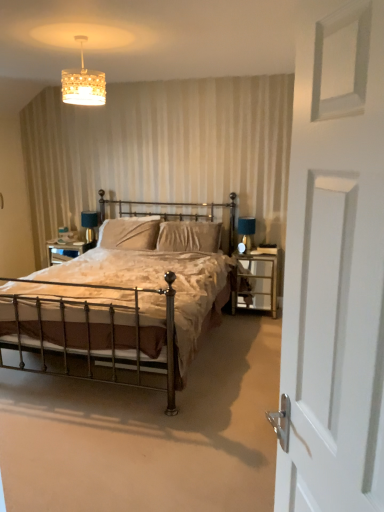
Question: Is matte blue glass table lamp at right located within white matte door at right?

Choices:
 (A) yes
 (B) no

Answer: (B)

Question: Can you confirm if white matte door at right is wider than matte blue glass table lamp at right?

Choices:
 (A) no
 (B) yes

Answer: (A)

Question: Is white matte door at right outside of matte blue glass table lamp at right?

Choices:
 (A) no
 (B) yes

Answer: (B)

Question: From the image's perspective, is white matte door at right below matte blue glass table lamp at right?

Choices:
 (A) no
 (B) yes

Answer: (B)

Question: Is white matte door at right positioned with its back to matte blue glass table lamp at right?

Choices:
 (A) no
 (B) yes

Answer: (A)

Question: Would you say white matte door at right is a long distance from matte blue glass table lamp at right?

Choices:
 (A) yes
 (B) no

Answer: (A)

Question: Does bronze metal bed at center have a greater width compared to metal/glass nightstand at right?

Choices:
 (A) no
 (B) yes

Answer: (B)

Question: Can you confirm if bronze metal bed at center is shorter than metal/glass nightstand at right?

Choices:
 (A) no
 (B) yes

Answer: (A)

Question: Could metal/glass nightstand at right be considered to be inside bronze metal bed at center?

Choices:
 (A) yes
 (B) no

Answer: (B)

Question: Does bronze metal bed at center appear on the right side of metal/glass nightstand at right?

Choices:
 (A) no
 (B) yes

Answer: (A)

Question: Can you confirm if bronze metal bed at center is positioned to the left of metal/glass nightstand at right?

Choices:
 (A) yes
 (B) no

Answer: (A)

Question: Is bronze metal bed at center facing away from metal/glass nightstand at right?

Choices:
 (A) no
 (B) yes

Answer: (A)

Question: Can you confirm if crystalline glass chandelier at upper center is smaller than velvet beige pillow at center, placed as the 1th pillow when sorted from right to left?

Choices:
 (A) yes
 (B) no

Answer: (A)